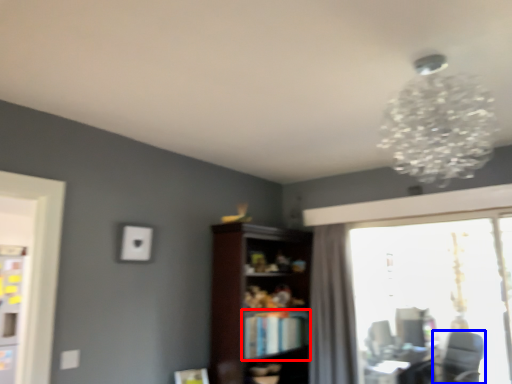
Question: Which object is further to the camera taking this photo, book (highlighted by a red box) or swivel chair (highlighted by a blue box)?

Choices:
 (A) book
 (B) swivel chair

Answer: (B)